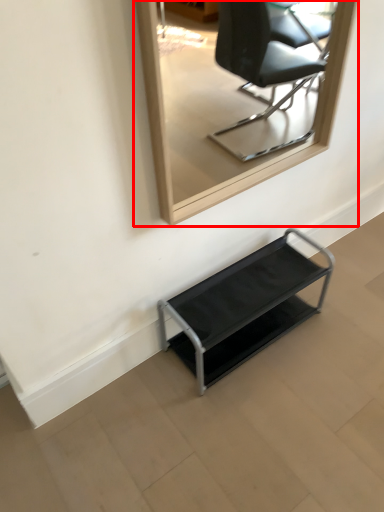
Question: Where is mirror (annotated by the red box) located in relation to furniture in the image?

Choices:
 (A) right
 (B) left

Answer: (B)